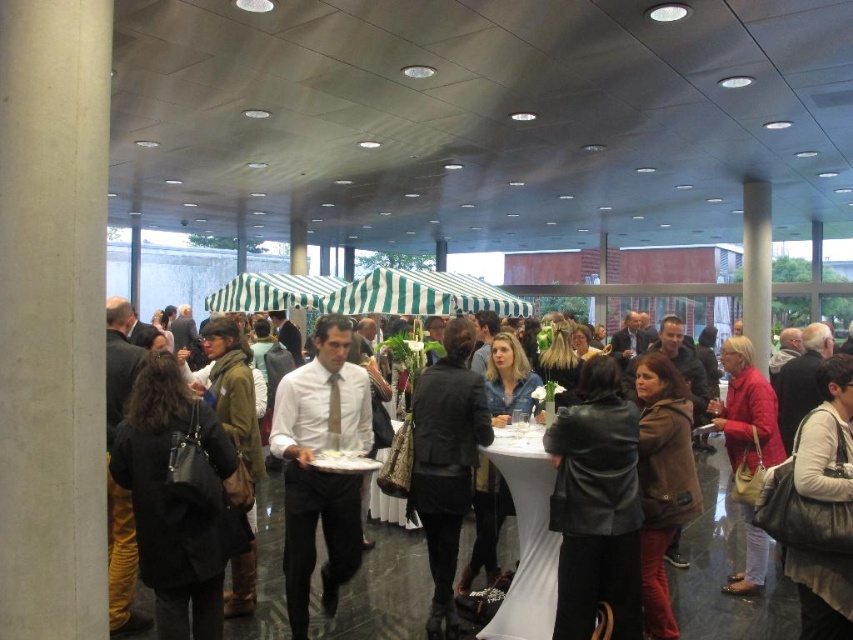
Which of these two, white shirt at center or white fabric table at center, stands taller?

Standing taller between the two is white fabric table at center.

Is point (776, 557) in front of point (546, 628)?

No, it is behind (546, 628).

Identify the location of white shirt at center. Image resolution: width=853 pixels, height=640 pixels. (724, 570).